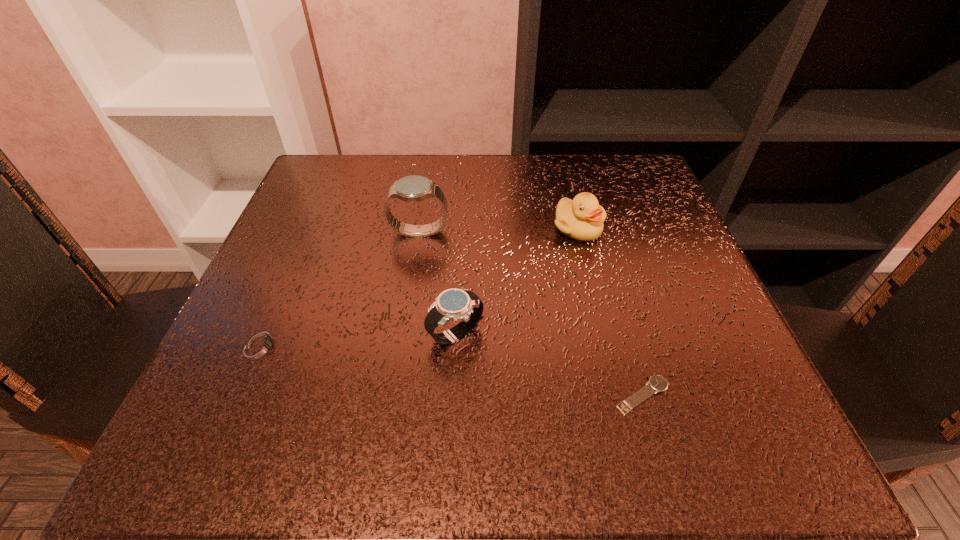
At what (x,y) coordinates should I click in order to perform the action: click on the tallest watch. Please return your answer as a coordinate pair (x, y). This screenshot has height=540, width=960. Looking at the image, I should click on (414, 188).

Locate an element on the screen. The height and width of the screenshot is (540, 960). the farthest watch is located at coordinates (414, 188).

This screenshot has width=960, height=540. I want to click on duckling, so click(x=582, y=218).

Identify the location of the second tallest watch. (462, 305).

This screenshot has width=960, height=540. Identify the location of the fourth tallest object. (262, 345).

Identify the location of the second shortest watch. (262, 345).

This screenshot has height=540, width=960. What are the coordinates of `the nearest watch` in the screenshot? It's located at (657, 383).

I want to click on the rightmost watch, so click(657, 383).

Locate an element on the screen. The image size is (960, 540). free region located on the back of the farthest watch is located at coordinates (428, 168).

Find the location of a particular element. The height and width of the screenshot is (540, 960). free region located 0.340m on the front-facing side of the duckling is located at coordinates (623, 408).